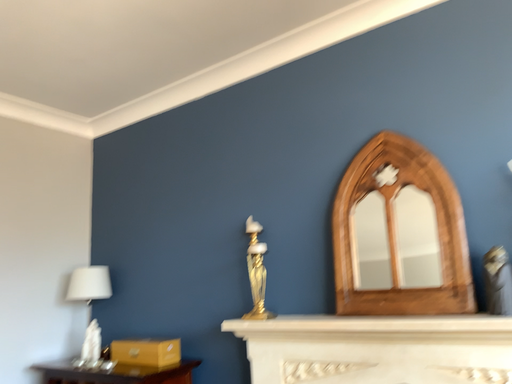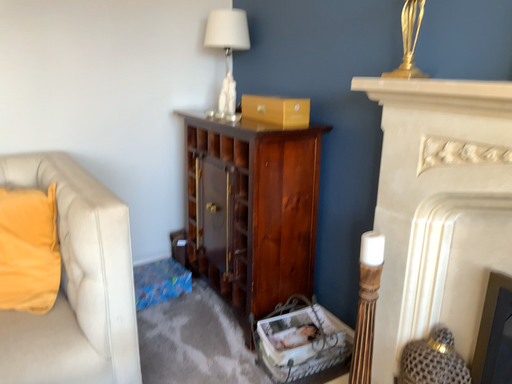
Question: Which way did the camera rotate in the video?

Choices:
 (A) rotated left
 (B) rotated right

Answer: (A)